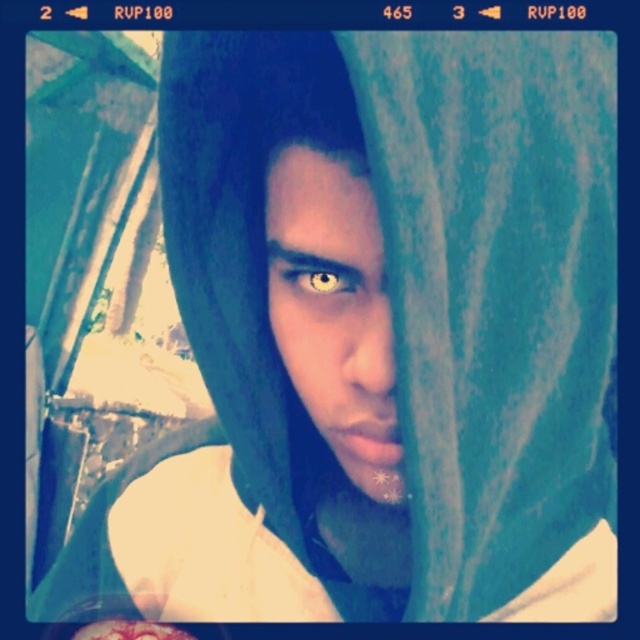
You are a photographer analyzing this selfie. You notice the matte skin face at center and the yellow matte eye at center. According to the image, which object is positioned higher?

The yellow matte eye at center is positioned higher than the matte skin face at center.

You are a photographer trying to adjust the lighting for a portrait. You notice the matte skin face at center and the yellow matte eye at center in your frame. Which object should you focus on to ensure proper exposure, considering their sizes?

The matte skin face at center is taller than the yellow matte eye at center, so focusing on the larger matte skin face at center would ensure proper exposure for the main subject.